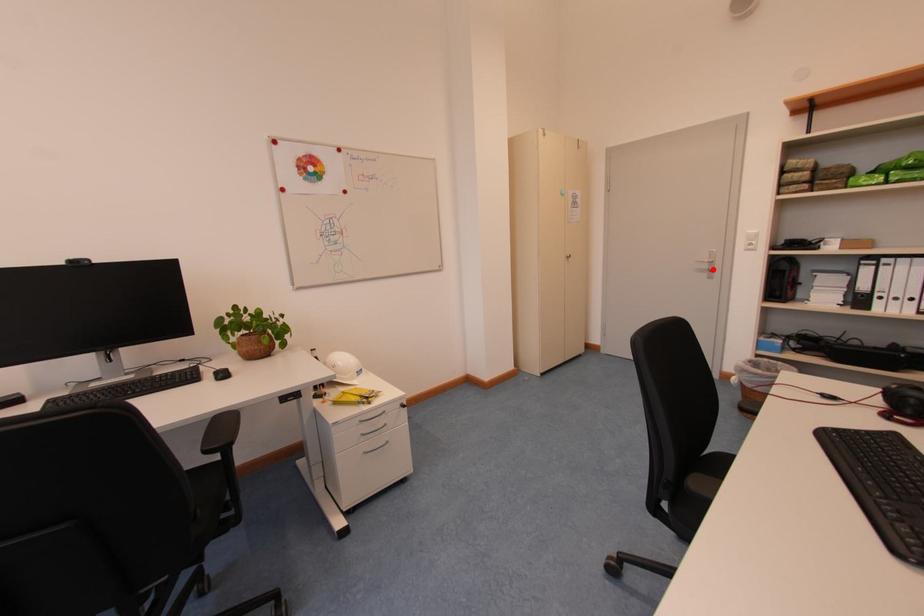
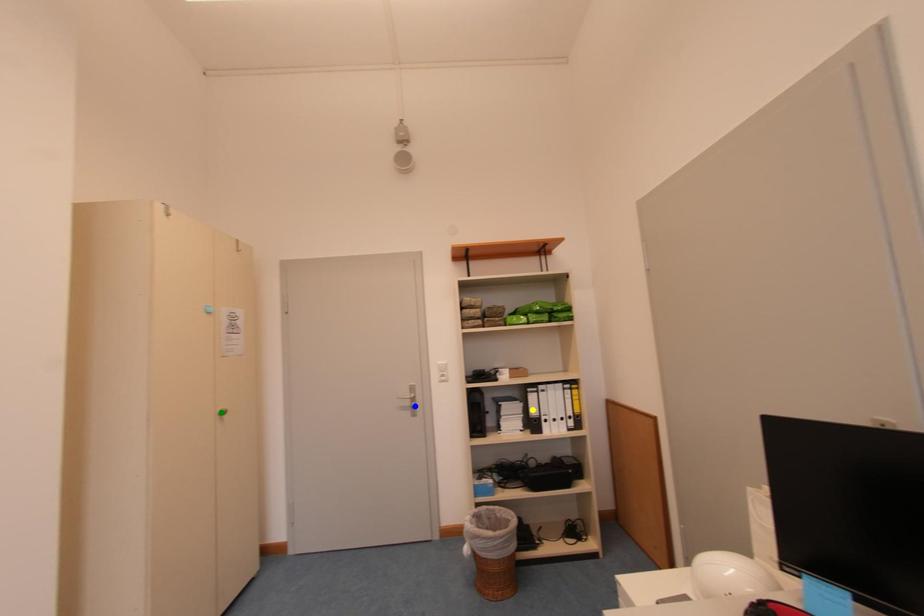
Question: I am providing you with two images of the same scene from different viewpoints. A red point is marked on the first image. You are given multiple points on the second image. Which spot in image 2 lines up with the point in image 1?

Choices:
 (A) yellow point
 (B) green point
 (C) blue point

Answer: (C)